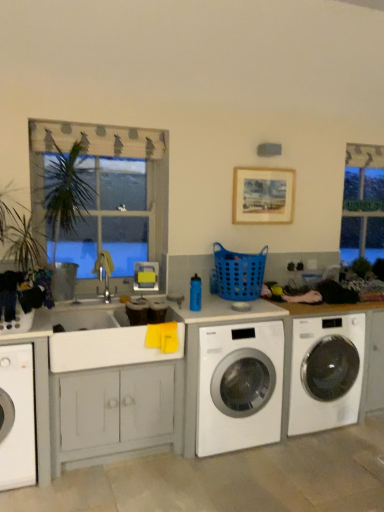
Question: Does wooden framed artwork at upper center appear on the right side of green glass sign at upper right?

Choices:
 (A) yes
 (B) no

Answer: (B)

Question: From a real-world perspective, is wooden framed artwork at upper center physically above green glass sign at upper right?

Choices:
 (A) no
 (B) yes

Answer: (B)

Question: Is wooden framed artwork at upper center located outside green glass sign at upper right?

Choices:
 (A) yes
 (B) no

Answer: (A)

Question: Does wooden framed artwork at upper center have a larger size compared to green glass sign at upper right?

Choices:
 (A) yes
 (B) no

Answer: (B)

Question: From the image's perspective, is wooden framed artwork at upper center over green glass sign at upper right?

Choices:
 (A) no
 (B) yes

Answer: (B)

Question: Is white glossy washing machine at center, the 3th washing machine in the left-to-right sequence, taller or shorter than white glossy washing machine at center, which is the second washing machine in left-to-right order?

Choices:
 (A) tall
 (B) short

Answer: (A)

Question: Based on their positions, is white glossy washing machine at center, which appears as the first washing machine when viewed from the right, located to the left or right of white glossy washing machine at center, which is the second washing machine in left-to-right order?

Choices:
 (A) left
 (B) right

Answer: (B)

Question: From the image's perspective, is white glossy washing machine at center, the 3th washing machine in the left-to-right sequence, positioned above or below white glossy washing machine at center, which is the second washing machine in right-to-left order?

Choices:
 (A) below
 (B) above

Answer: (B)

Question: Is white glossy washing machine at center, the 3th washing machine in the left-to-right sequence, wider or thinner than white glossy washing machine at center, which is the second washing machine in left-to-right order?

Choices:
 (A) wide
 (B) thin

Answer: (B)

Question: From a real-world perspective, is white glossy washing machine at center, which is the second washing machine in right-to-left order, above or below blue plastic basket at center?

Choices:
 (A) below
 (B) above

Answer: (A)

Question: Considering their positions, is white glossy washing machine at center, which is the second washing machine in left-to-right order, located in front of or behind blue plastic basket at center?

Choices:
 (A) front
 (B) behind

Answer: (A)

Question: Looking at their shapes, would you say white glossy washing machine at center, which is the second washing machine in right-to-left order, is wider or thinner than blue plastic basket at center?

Choices:
 (A) wide
 (B) thin

Answer: (A)

Question: Would you say white glossy washing machine at center, which is the second washing machine in right-to-left order, is inside or outside blue plastic basket at center?

Choices:
 (A) outside
 (B) inside

Answer: (A)

Question: Choose the correct answer: Is white glossy washing machine at center, which is the second washing machine in left-to-right order, inside wooden framed artwork at upper center or outside it?

Choices:
 (A) outside
 (B) inside

Answer: (A)

Question: Is point (241, 433) positioned closer to the camera than point (279, 215)?

Choices:
 (A) farther
 (B) closer

Answer: (B)